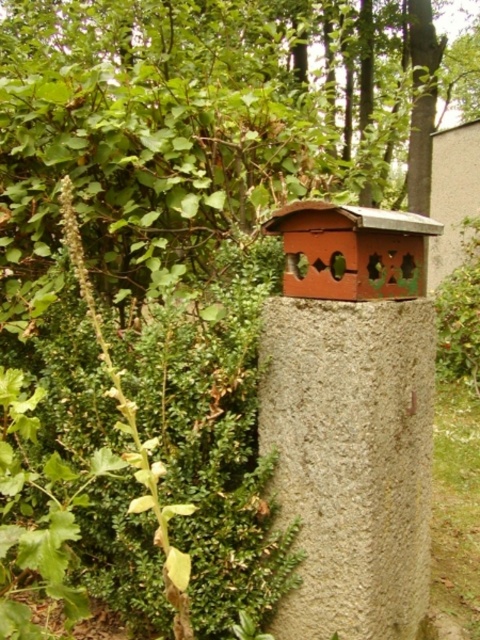
From the picture: You are a bird looking for a place to land. You see the green leafy tree at upper left and the gray concrete post at center. Which object is closer to you?

The green leafy tree at upper left is closer to you because the gray concrete post at center is behind it.

You are a bird looking for a nesting spot. You see the green leafy tree at upper left and the gray concrete post at center. Which one is shorter and might be easier to build a nest in?

The green leafy tree at upper left is shorter than the gray concrete post at center, so it might be easier to build a nest there.

You are a bird looking for a place to land. You see the green leafy tree at upper left and the gray concrete post at center. Which one is closer to the birdhouse?

The green leafy tree at upper left is positioned over the gray concrete post at center, so the green leafy tree at upper left is closer to the birdhouse than the gray concrete post at center.